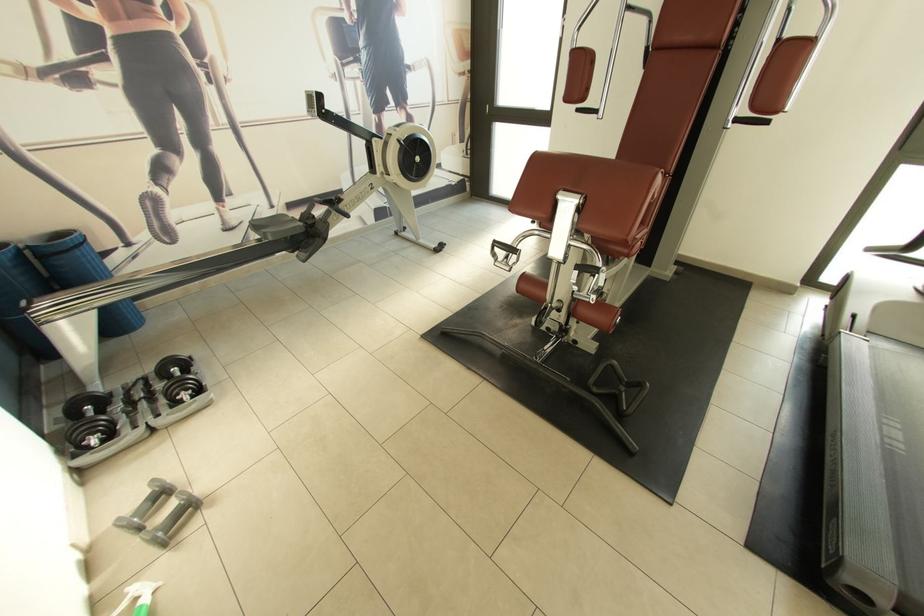
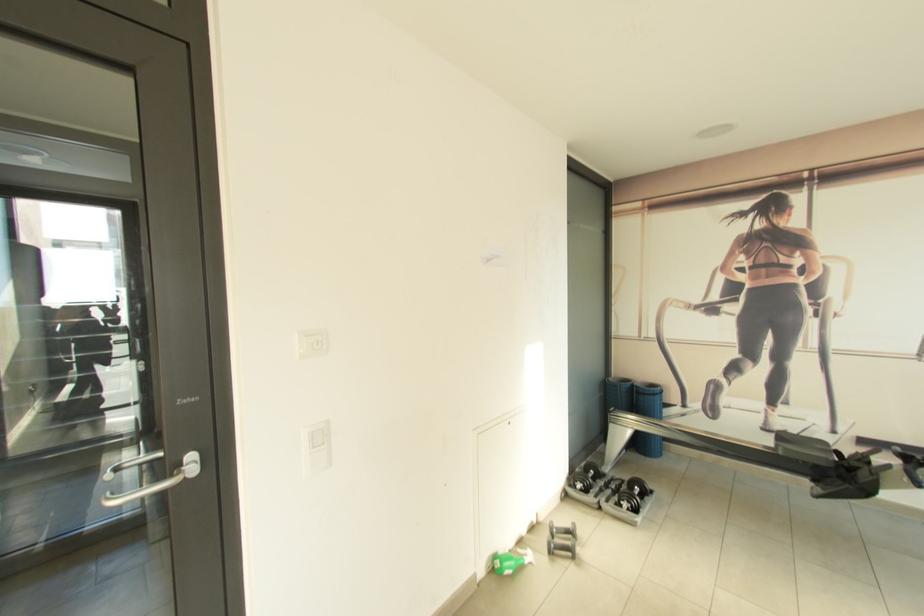
Question: The camera is either moving clockwise (left) or counter-clockwise (right) around the object. The first image is from the beginning of the video and the second image is from the end. Is the camera moving left or right when shooting the video?

Choices:
 (A) Left
 (B) Right

Answer: (B)